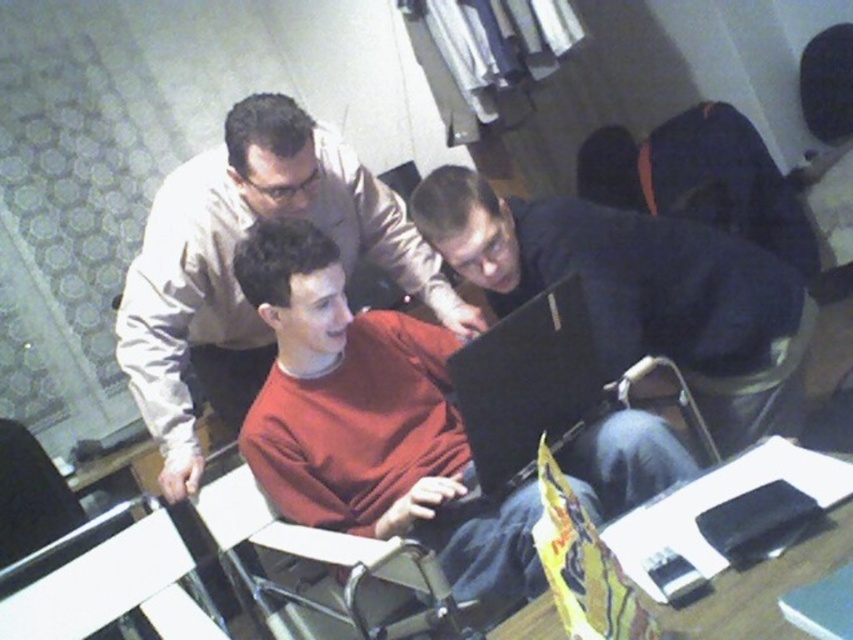
Is matte beige shirt at center to the left of metallic silver chair at center from the viewer's perspective?

Yes, matte beige shirt at center is to the left of metallic silver chair at center.

Can you confirm if matte beige shirt at center is positioned above metallic silver chair at center?

Indeed, matte beige shirt at center is positioned over metallic silver chair at center.

What do you see at coordinates (231, 273) in the screenshot? I see `matte beige shirt at center` at bounding box center [231, 273].

The width and height of the screenshot is (853, 640). Identify the location of matte beige shirt at center. (231, 273).

Can you confirm if matte beige shirt at center is positioned to the right of white plastic chair at lower left?

Correct, you'll find matte beige shirt at center to the right of white plastic chair at lower left.

Is matte beige shirt at center bigger than white plastic chair at lower left?

Yes.

The image size is (853, 640). I want to click on matte beige shirt at center, so click(x=231, y=273).

Can you confirm if matte red sweater at center is taller than black glossy laptop at center?

Indeed, matte red sweater at center has a greater height compared to black glossy laptop at center.

The height and width of the screenshot is (640, 853). I want to click on matte red sweater at center, so click(x=370, y=420).

This screenshot has height=640, width=853. Find the location of `matte red sweater at center`. matte red sweater at center is located at coordinates (x=370, y=420).